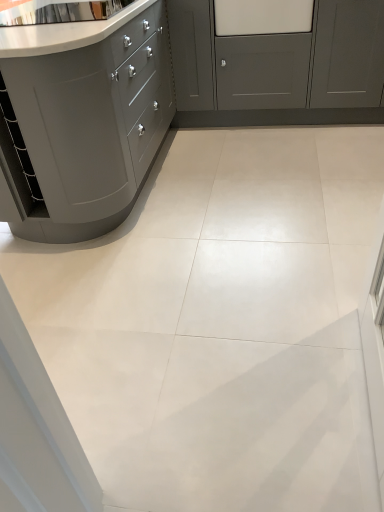
Describe the element at coordinates (83, 120) in the screenshot. I see `matte gray cabinet at left, placed as the 2th cabinetry when sorted from right to left` at that location.

This screenshot has width=384, height=512. What are the coordinates of `matte gray cabinet at left, the first cabinetry in the left-to-right sequence` in the screenshot? It's located at (83, 120).

What is the approximate width of matte gray cabinet at upper right, which appears as the second cabinetry when viewed from the left?

The width of matte gray cabinet at upper right, which appears as the second cabinetry when viewed from the left, is 23.63 inches.

Describe the element at coordinates (277, 62) in the screenshot. The image size is (384, 512). I see `matte gray cabinet at upper right, which appears as the second cabinetry when viewed from the left` at that location.

The image size is (384, 512). I want to click on matte gray cabinet at upper right, which appears as the second cabinetry when viewed from the left, so click(x=277, y=62).

The image size is (384, 512). Identify the location of matte gray cabinet at left, the first cabinetry in the left-to-right sequence. (83, 120).

Between matte gray cabinet at left, placed as the 2th cabinetry when sorted from right to left, and matte gray cabinet at upper right, which appears as the second cabinetry when viewed from the left, which one appears on the left side from the viewer's perspective?

matte gray cabinet at left, placed as the 2th cabinetry when sorted from right to left.

Is matte gray cabinet at left, placed as the 2th cabinetry when sorted from right to left, closer to the viewer compared to matte gray cabinet at upper right, which ranks as the 1th cabinetry in right-to-left order?

Yes, the depth of matte gray cabinet at left, placed as the 2th cabinetry when sorted from right to left, is less than that of matte gray cabinet at upper right, which ranks as the 1th cabinetry in right-to-left order.

Considering the positions of point (0, 88) and point (358, 105), is point (0, 88) closer or farther from the camera than point (358, 105)?

Point (0, 88).

From the image's perspective, is matte gray cabinet at left, placed as the 2th cabinetry when sorted from right to left, on top of matte gray cabinet at upper right, which appears as the second cabinetry when viewed from the left?

No, from the image's perspective, matte gray cabinet at left, placed as the 2th cabinetry when sorted from right to left, is not on top of matte gray cabinet at upper right, which appears as the second cabinetry when viewed from the left.

From a real-world perspective, is matte gray cabinet at left, placed as the 2th cabinetry when sorted from right to left, physically located above or below matte gray cabinet at upper right, which ranks as the 1th cabinetry in right-to-left order?

matte gray cabinet at left, placed as the 2th cabinetry when sorted from right to left, is above matte gray cabinet at upper right, which ranks as the 1th cabinetry in right-to-left order.

Looking at their sizes, would you say matte gray cabinet at left, placed as the 2th cabinetry when sorted from right to left, is wider or thinner than matte gray cabinet at upper right, which appears as the second cabinetry when viewed from the left?

Considering their sizes, matte gray cabinet at left, placed as the 2th cabinetry when sorted from right to left, looks broader than matte gray cabinet at upper right, which appears as the second cabinetry when viewed from the left.

Considering the relative sizes of matte gray cabinet at left, the first cabinetry in the left-to-right sequence, and matte gray cabinet at upper right, which ranks as the 1th cabinetry in right-to-left order, in the image provided, is matte gray cabinet at left, the first cabinetry in the left-to-right sequence, taller than matte gray cabinet at upper right, which ranks as the 1th cabinetry in right-to-left order,?

Correct, matte gray cabinet at left, the first cabinetry in the left-to-right sequence, is much taller as matte gray cabinet at upper right, which ranks as the 1th cabinetry in right-to-left order.

Considering the relative sizes of matte gray cabinet at left, placed as the 2th cabinetry when sorted from right to left, and matte gray cabinet at upper right, which appears as the second cabinetry when viewed from the left, in the image provided, is matte gray cabinet at left, placed as the 2th cabinetry when sorted from right to left, bigger than matte gray cabinet at upper right, which appears as the second cabinetry when viewed from the left,?

Yes.

Is matte gray cabinet at left, the first cabinetry in the left-to-right sequence, not within matte gray cabinet at upper right, which ranks as the 1th cabinetry in right-to-left order?

matte gray cabinet at left, the first cabinetry in the left-to-right sequence, lies outside matte gray cabinet at upper right, which ranks as the 1th cabinetry in right-to-left order,'s area.

Can you see matte gray cabinet at left, placed as the 2th cabinetry when sorted from right to left, touching matte gray cabinet at upper right, which ranks as the 1th cabinetry in right-to-left order?

They are not placed beside each other.

Could you tell me if matte gray cabinet at left, the first cabinetry in the left-to-right sequence, is facing matte gray cabinet at upper right, which ranks as the 1th cabinetry in right-to-left order?

Yes, matte gray cabinet at left, the first cabinetry in the left-to-right sequence, is aimed at matte gray cabinet at upper right, which ranks as the 1th cabinetry in right-to-left order.

What's the angular difference between matte gray cabinet at left, placed as the 2th cabinetry when sorted from right to left, and matte gray cabinet at upper right, which appears as the second cabinetry when viewed from the left,'s facing directions?

matte gray cabinet at left, placed as the 2th cabinetry when sorted from right to left, and matte gray cabinet at upper right, which appears as the second cabinetry when viewed from the left, are facing 90.1 degrees away from each other.

This screenshot has width=384, height=512. I want to click on cabinetry lying on the right of matte gray cabinet at left, placed as the 2th cabinetry when sorted from right to left, so click(x=277, y=62).

Between matte gray cabinet at upper right, which appears as the second cabinetry when viewed from the left, and matte gray cabinet at left, the first cabinetry in the left-to-right sequence, which one appears on the left side from the viewer's perspective?

matte gray cabinet at left, the first cabinetry in the left-to-right sequence.

Considering the positions of objects matte gray cabinet at upper right, which ranks as the 1th cabinetry in right-to-left order, and matte gray cabinet at left, placed as the 2th cabinetry when sorted from right to left, in the image provided, who is behind, matte gray cabinet at upper right, which ranks as the 1th cabinetry in right-to-left order, or matte gray cabinet at left, placed as the 2th cabinetry when sorted from right to left,?

matte gray cabinet at upper right, which ranks as the 1th cabinetry in right-to-left order, is further away from the camera.

Is point (196, 47) closer to viewer compared to point (81, 201)?

No, (196, 47) is further to viewer.

From the image's perspective, between matte gray cabinet at upper right, which ranks as the 1th cabinetry in right-to-left order, and matte gray cabinet at left, the first cabinetry in the left-to-right sequence, who is located below?

matte gray cabinet at left, the first cabinetry in the left-to-right sequence.

From a real-world perspective, is matte gray cabinet at upper right, which ranks as the 1th cabinetry in right-to-left order, on matte gray cabinet at left, the first cabinetry in the left-to-right sequence?

No, from a real-world perspective, matte gray cabinet at upper right, which ranks as the 1th cabinetry in right-to-left order, is not above matte gray cabinet at left, the first cabinetry in the left-to-right sequence.

Which object is wider, matte gray cabinet at upper right, which ranks as the 1th cabinetry in right-to-left order, or matte gray cabinet at left, placed as the 2th cabinetry when sorted from right to left?

matte gray cabinet at left, placed as the 2th cabinetry when sorted from right to left, is wider.

Is matte gray cabinet at upper right, which appears as the second cabinetry when viewed from the left, taller than matte gray cabinet at left, the first cabinetry in the left-to-right sequence?

In fact, matte gray cabinet at upper right, which appears as the second cabinetry when viewed from the left, may be shorter than matte gray cabinet at left, the first cabinetry in the left-to-right sequence.

In terms of size, does matte gray cabinet at upper right, which appears as the second cabinetry when viewed from the left, appear bigger or smaller than matte gray cabinet at left, the first cabinetry in the left-to-right sequence?

matte gray cabinet at upper right, which appears as the second cabinetry when viewed from the left, is smaller than matte gray cabinet at left, the first cabinetry in the left-to-right sequence.

Choose the correct answer: Is matte gray cabinet at upper right, which appears as the second cabinetry when viewed from the left, inside matte gray cabinet at left, the first cabinetry in the left-to-right sequence, or outside it?

matte gray cabinet at upper right, which appears as the second cabinetry when viewed from the left, is located beyond the bounds of matte gray cabinet at left, the first cabinetry in the left-to-right sequence.

Is matte gray cabinet at upper right, which ranks as the 1th cabinetry in right-to-left order, not close to matte gray cabinet at left, placed as the 2th cabinetry when sorted from right to left?

Yes, matte gray cabinet at upper right, which ranks as the 1th cabinetry in right-to-left order, is far from matte gray cabinet at left, placed as the 2th cabinetry when sorted from right to left.

Is matte gray cabinet at upper right, which appears as the second cabinetry when viewed from the left, facing towards matte gray cabinet at left, placed as the 2th cabinetry when sorted from right to left?

No, matte gray cabinet at upper right, which appears as the second cabinetry when viewed from the left, is not aimed at matte gray cabinet at left, placed as the 2th cabinetry when sorted from right to left.

Locate an element on the screen. The image size is (384, 512). cabinetry below the matte gray cabinet at left, the first cabinetry in the left-to-right sequence (from a real-world perspective) is located at coordinates (277, 62).

Find the location of `cabinetry that appears on the left of matte gray cabinet at upper right, which ranks as the 1th cabinetry in right-to-left order`. cabinetry that appears on the left of matte gray cabinet at upper right, which ranks as the 1th cabinetry in right-to-left order is located at coordinates (83, 120).

This screenshot has width=384, height=512. I want to click on cabinetry in front of the matte gray cabinet at upper right, which appears as the second cabinetry when viewed from the left, so click(x=83, y=120).